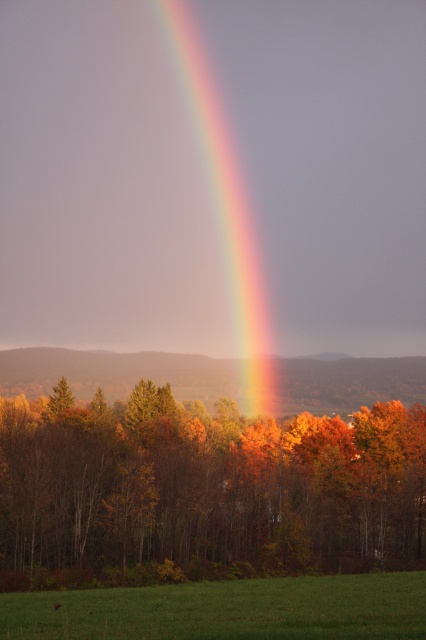
Question: Based on their relative distances, which object is farther from the green grass at lower center?

Choices:
 (A) autumn leaves at center
 (B) rainbow at center

Answer: (B)

Question: Considering the relative positions of green grass at lower center and rainbow at center in the image provided, where is green grass at lower center located with respect to rainbow at center?

Choices:
 (A) above
 (B) below

Answer: (B)

Question: Is autumn leaves at center to the right of green grass at lower center from the viewer's perspective?

Choices:
 (A) yes
 (B) no

Answer: (A)

Question: Can you confirm if autumn leaves at center is positioned below rainbow at center?

Choices:
 (A) yes
 (B) no

Answer: (A)

Question: Which point appears farthest from the camera in this image?

Choices:
 (A) (275, 502)
 (B) (210, 616)
 (C) (253, 298)

Answer: (C)

Question: Which object is the farthest from the rainbow at center?

Choices:
 (A) green grass at lower center
 (B) autumn leaves at center

Answer: (A)